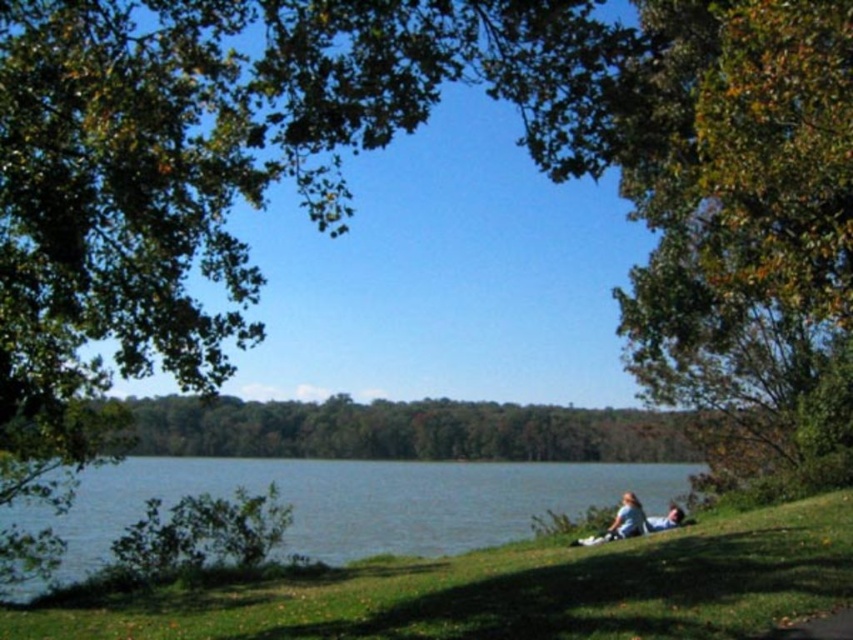
Question: Among these objects, which one is farthest from the camera?

Choices:
 (A) green leafy tree at right
 (B) light blue fabric couple at lower right
 (C) blue water at lower left

Answer: (B)

Question: Can you confirm if blue water at lower left is positioned above light blue fabric couple at lower right?

Choices:
 (A) no
 (B) yes

Answer: (A)

Question: Among these points, which one is farthest from the camera?

Choices:
 (A) pyautogui.click(x=631, y=506)
 (B) pyautogui.click(x=44, y=515)

Answer: (B)

Question: Which object is the farthest from the green leafy tree at right?

Choices:
 (A) blue water at lower left
 (B) light blue fabric couple at lower right

Answer: (A)

Question: Is green leafy tree at right above blue water at lower left?

Choices:
 (A) yes
 (B) no

Answer: (A)

Question: Is green leafy tree at right above blue water at lower left?

Choices:
 (A) yes
 (B) no

Answer: (A)